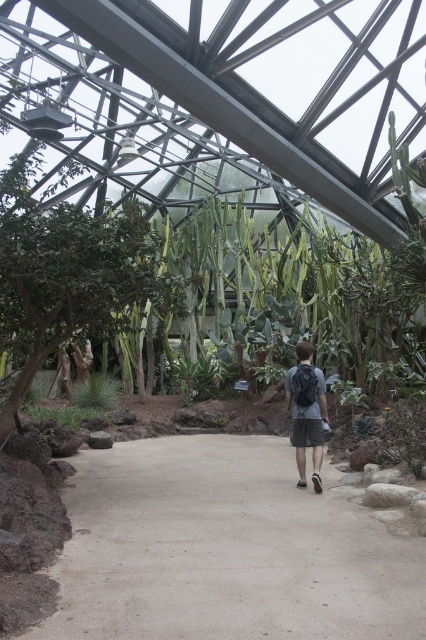
Describe the element at coordinates (227, 548) in the screenshot. I see `smooth concrete path at center` at that location.

Who is taller, smooth concrete path at center or dark gray backpack at center?

Standing taller between the two is dark gray backpack at center.

Measure the distance between point (222, 529) and camera.

Point (222, 529) and camera are 5.41 meters apart from each other.

You are a GUI agent. You are given a task and a screenshot of the screen. Output one action in this format:
    pyautogui.click(x=<x>, y=<y>)
    Task: Click on the smooth concrete path at center
    This screenshot has width=426, height=640.
    Given the screenshot: What is the action you would take?
    pyautogui.click(x=227, y=548)